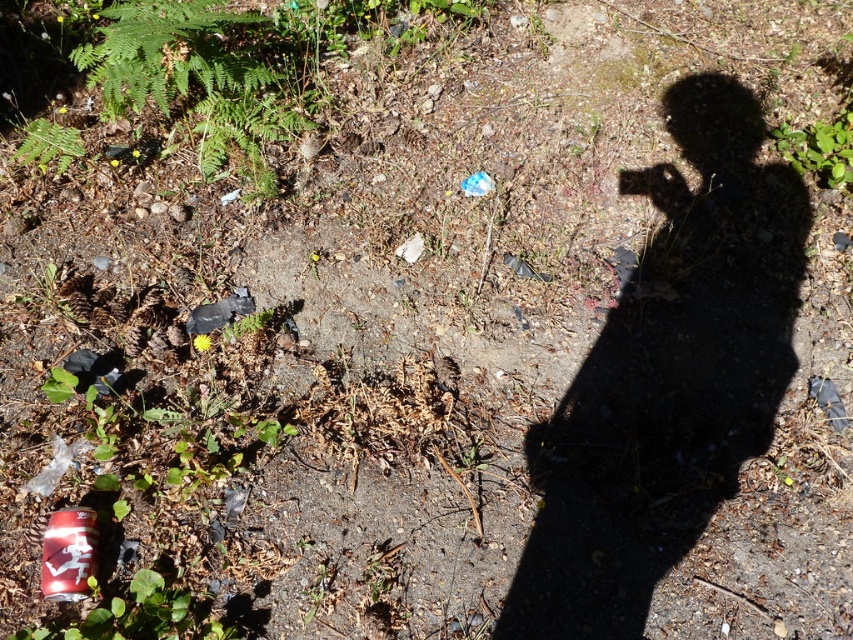
You are a gardener trying to clear the area. You need to know which object is wider to prioritize removal. Which is wider between the red matte can at bottom left and the green leafy weed at upper right?

The green leafy weed at upper right is wider than the red matte can at bottom left.

You are a gardener who needs to remove the red matte can at bottom left and the green leafy weed at upper right. Based on their positions, which object should you reach for first if you are standing at the center of the scene?

The red matte can at bottom left should be reached for first because it is positioned on the left side of the green leafy weed at upper right, making it closer to your current position at the center.